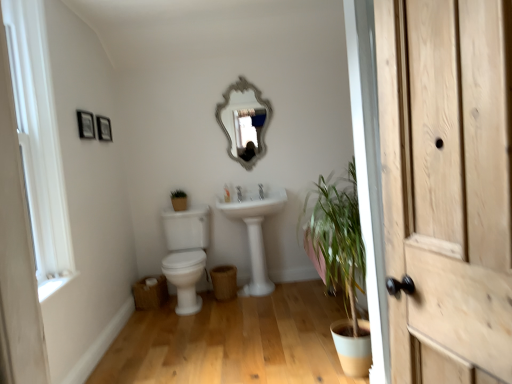
This screenshot has height=384, width=512. Identify the location of vacant space underneath white glossy sink at center (from a real-world perspective). (266, 296).